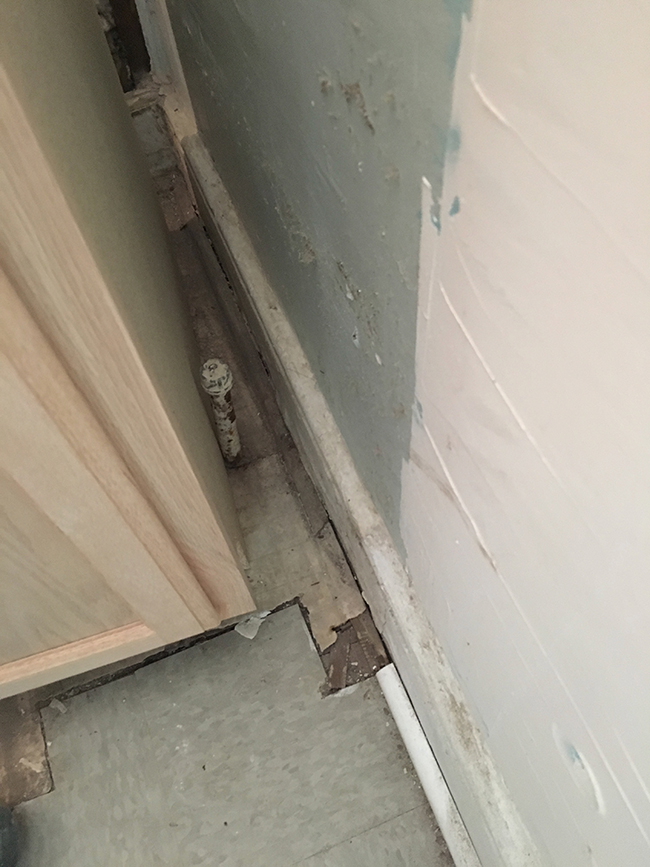
Find the location of `gray floor tile`. gray floor tile is located at coordinates (229, 789).